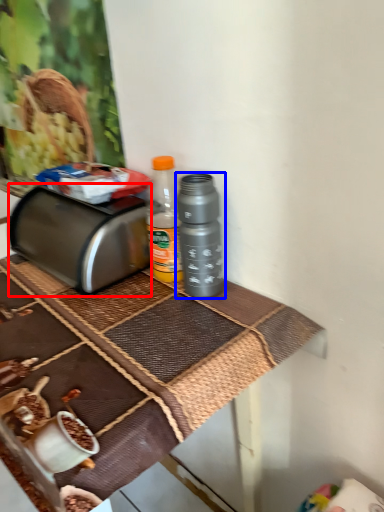
Question: Which of the following is the farthest to the observer, toaster (highlighted by a red box) or bottle (highlighted by a blue box)?

Choices:
 (A) toaster
 (B) bottle

Answer: (A)